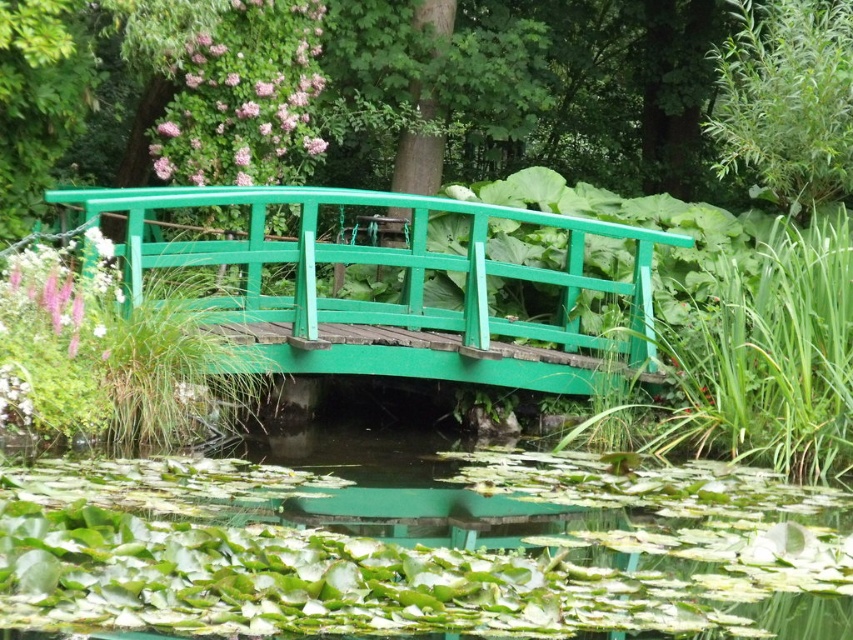
Question: Which object appears farthest from the camera in this image?

Choices:
 (A) green lily pads at center
 (B) green wooden bridge at center

Answer: (B)

Question: Which of the following is the closest to the observer?

Choices:
 (A) green wooden bridge at center
 (B) green lily pads at center

Answer: (B)

Question: Does green lily pads at center appear on the left side of green wooden bridge at center?

Choices:
 (A) no
 (B) yes

Answer: (A)

Question: Does green lily pads at center appear on the left side of green wooden bridge at center?

Choices:
 (A) no
 (B) yes

Answer: (A)

Question: Does green lily pads at center have a smaller size compared to green wooden bridge at center?

Choices:
 (A) yes
 (B) no

Answer: (A)